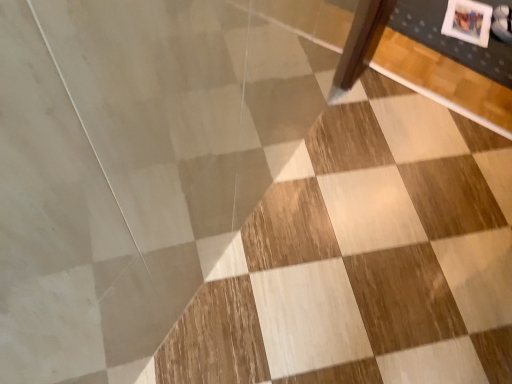
In order to click on white matte photo frame at upper right in this screenshot , I will do `click(468, 21)`.

Measure the distance between point (451, 32) and camera.

Point (451, 32) and camera are 1.93 meters apart.

Image resolution: width=512 pixels, height=384 pixels. What do you see at coordinates (468, 21) in the screenshot?
I see `white matte photo frame at upper right` at bounding box center [468, 21].

You are a GUI agent. You are given a task and a screenshot of the screen. Output one action in this format:
    pyautogui.click(x=<x>, y=<y>)
    Task: Click on the white matte photo frame at upper right
    
    Given the screenshot: What is the action you would take?
    468,21